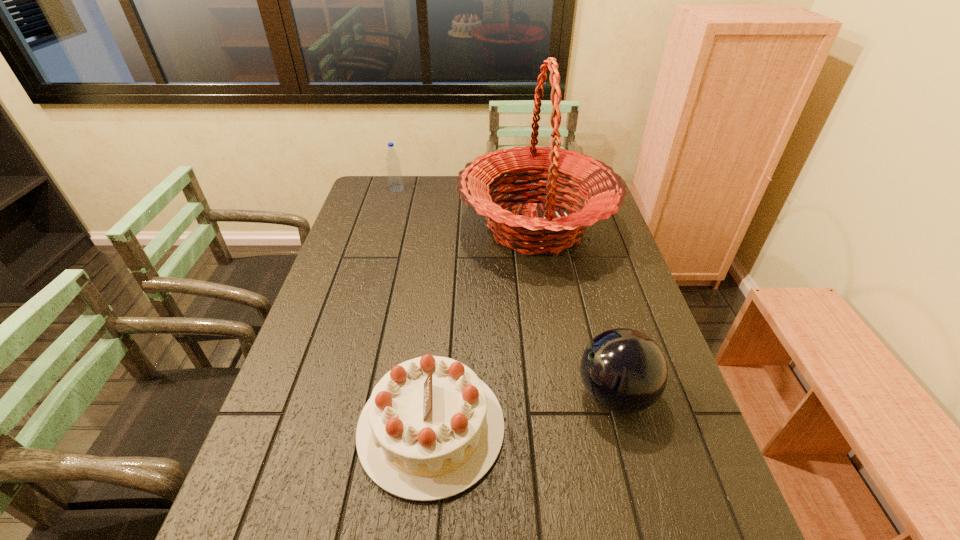
Where is `basket`? basket is located at coordinates (552, 234).

You are a GUI agent. You are given a task and a screenshot of the screen. Output one action in this format:
    pyautogui.click(x=<x>, y=<y>)
    Task: Click on the leftmost object
    The image size is (960, 540).
    Given the screenshot: What is the action you would take?
    pyautogui.click(x=394, y=172)

I want to click on bowling ball, so click(x=623, y=370).

At what (x,y) coordinates should I click in order to perform the action: click on birthday cake. Please return your answer as a coordinate pair (x, y). This screenshot has height=540, width=960. Looking at the image, I should click on (431, 429).

What are the coordinates of `free space located 0.330m on the front of the tallest object` in the screenshot? It's located at (559, 368).

The height and width of the screenshot is (540, 960). Find the location of `free space located on the right of the water bottle`. free space located on the right of the water bottle is located at coordinates (481, 189).

Identify the location of free space located on the side of the bowling ball with the finger holes. This screenshot has width=960, height=540. (437, 395).

Locate an element on the screen. The height and width of the screenshot is (540, 960). blank space located 0.390m on the side of the bowling ball with the finger holes is located at coordinates (406, 395).

Where is `vacant space located 0.050m on the side of the bowling ball with the finger holes`? The width and height of the screenshot is (960, 540). vacant space located 0.050m on the side of the bowling ball with the finger holes is located at coordinates (554, 395).

Where is `free spot located on the back of the shortest object`? This screenshot has width=960, height=540. free spot located on the back of the shortest object is located at coordinates (445, 271).